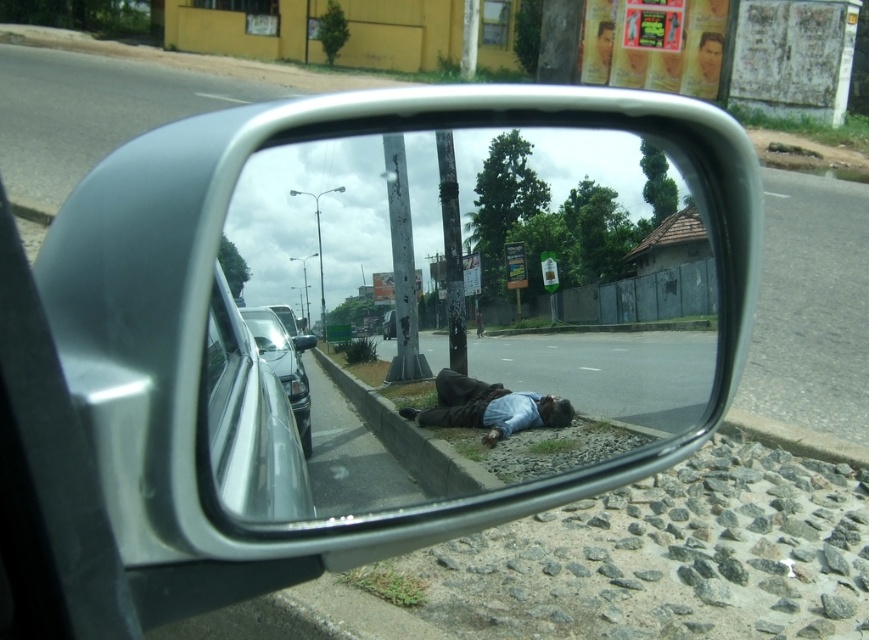
Is point (266, 468) positioned after point (304, 454)?

No, (266, 468) is in front of (304, 454).

Is clear glass car window at lower left further to camera compared to shiny silver car at lower left?

No.

Is point (250, 342) in front of point (269, 358)?

Yes, it is in front of point (269, 358).

In order to click on clear glass car window at lower left in this screenshot , I will do `click(251, 413)`.

Who is lower down, shiny silver car at lower left or shiny black car at lower center?

shiny silver car at lower left is below.

Who is more forward, [303,412] or [390,321]?

Point [390,321]

Identify the location of shiny silver car at lower left. The image size is (869, 640). (284, 364).

Who is taller, clear glass mirror at center or clear glass car window at lower left?

clear glass mirror at center

Between clear glass mirror at center and clear glass car window at lower left, which one is positioned higher?

clear glass mirror at center is above.

Where is `clear glass mirror at center`? The width and height of the screenshot is (869, 640). clear glass mirror at center is located at coordinates (495, 280).